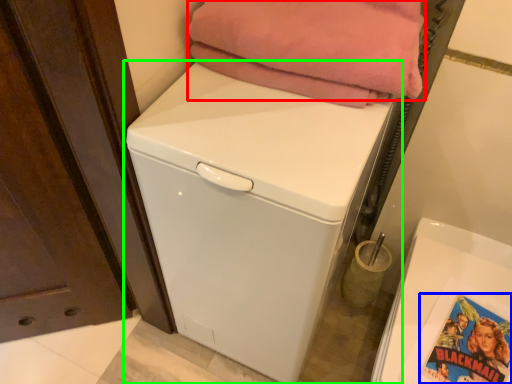
Question: Estimate the real-world distances between objects in this image. Which object is farther from blanket (highlighted by a red box), comic book (highlighted by a blue box) or washing machine (highlighted by a green box)?

Choices:
 (A) comic book
 (B) washing machine

Answer: (A)